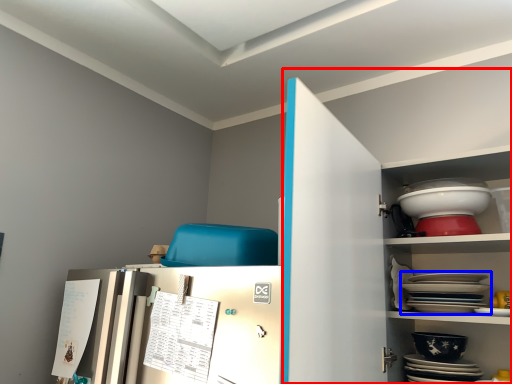
Question: Which of the following is the farthest to the observer, dresser (highlighted by a red box) or platter (highlighted by a blue box)?

Choices:
 (A) dresser
 (B) platter

Answer: (B)